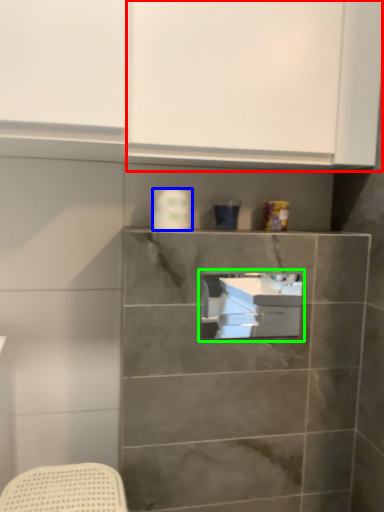
Question: Which object is the closest to the cabinetry (highlighted by a red box)? Choose among these: toilet paper (highlighted by a blue box) or sink (highlighted by a green box).

Choices:
 (A) toilet paper
 (B) sink

Answer: (A)